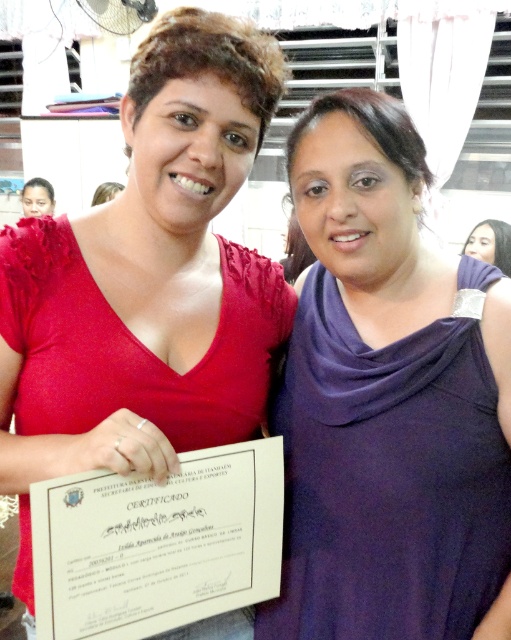
Question: Is purple matte dress at center to the left of matte black hair at upper left from the viewer's perspective?

Choices:
 (A) no
 (B) yes

Answer: (A)

Question: Does purple matte dress at center have a smaller size compared to purple matte scarf at upper right?

Choices:
 (A) yes
 (B) no

Answer: (B)

Question: Which of the following is the closest to the observer?

Choices:
 (A) matte red dress at center
 (B) purple matte dress at center
 (C) matte black hair at upper left
 (D) purple matte scarf at upper right

Answer: (A)

Question: Is matte red dress at center to the right of white paper certificate at center from the viewer's perspective?

Choices:
 (A) yes
 (B) no

Answer: (B)

Question: Which of these objects is positioned farthest from the purple matte scarf at upper right?

Choices:
 (A) white paper certificate at center
 (B) matte red dress at center
 (C) matte black hair at upper left

Answer: (C)

Question: Which point is closer to the camera taking this photo?

Choices:
 (A) (497, 253)
 (B) (16, 436)
 (C) (28, 208)

Answer: (B)